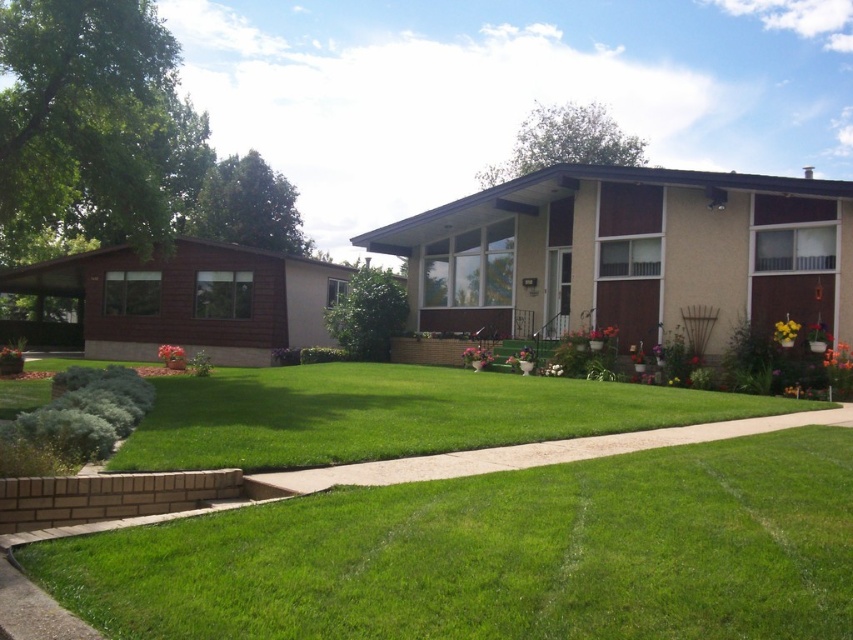
You are standing at the front door of the suburban home and want to walk to the yellow matte flower at lower right. Which direction should you turn to face the green lawn at lower center first before proceeding?

Since the green lawn at lower center is to the left of the yellow matte flower at lower right, you should turn to your left to face the green lawn at lower center first before moving towards the yellow matte flower at lower right.

You are standing at the front door of the suburban home and want to place a new potted plant. The existing potted plants are located at point (x=838, y=356). Where should you place the new potted plant to avoid blocking the orange matte flower at lower right?

Place the new potted plant away from point (x=838, y=356) to avoid blocking the orange matte flower at lower right located there.

You are standing in front of the suburban home and see the orange matte flower at lower right and the orange matte flower pot at lower left. Which one is positioned to the right side?

The orange matte flower at lower right is positioned to the right of the orange matte flower pot at lower left.